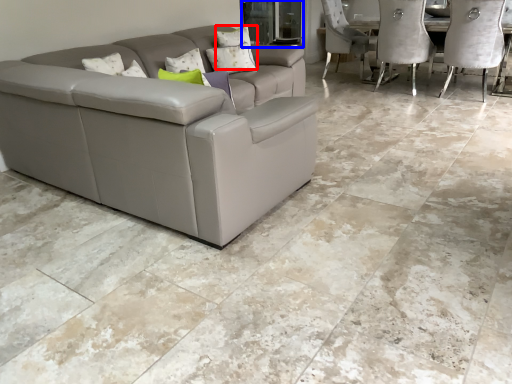
Question: Which of the following is the closest to the observer, pillow (highlighted by a red box) or glass door (highlighted by a blue box)?

Choices:
 (A) pillow
 (B) glass door

Answer: (A)